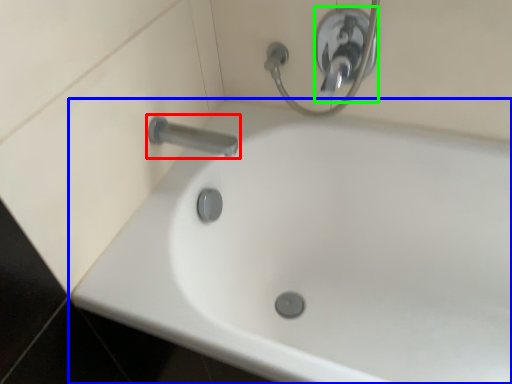
Question: Based on their relative distances, which object is farther from tap (highlighted by a red box)? Choose from bathtub (highlighted by a blue box) and shower (highlighted by a green box).

Choices:
 (A) bathtub
 (B) shower

Answer: (A)